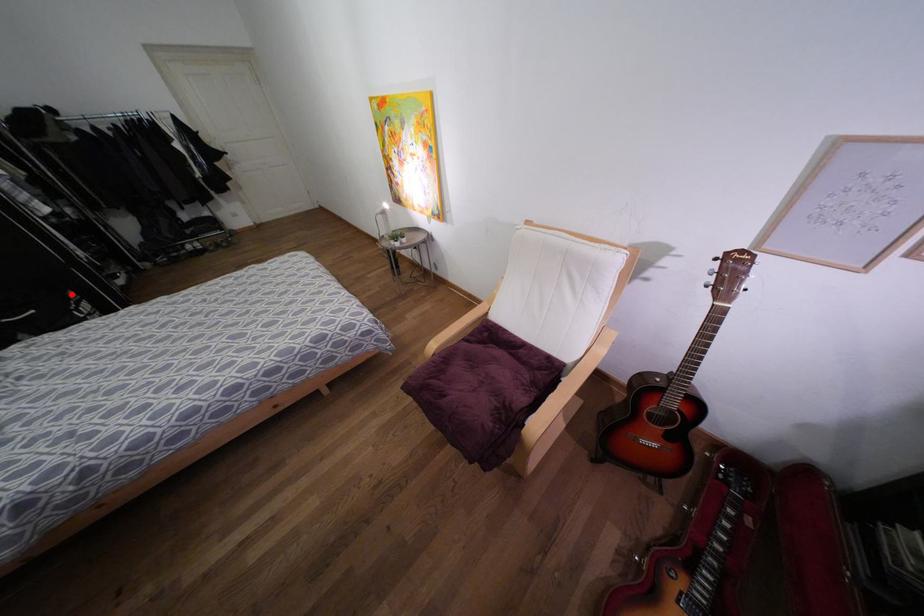
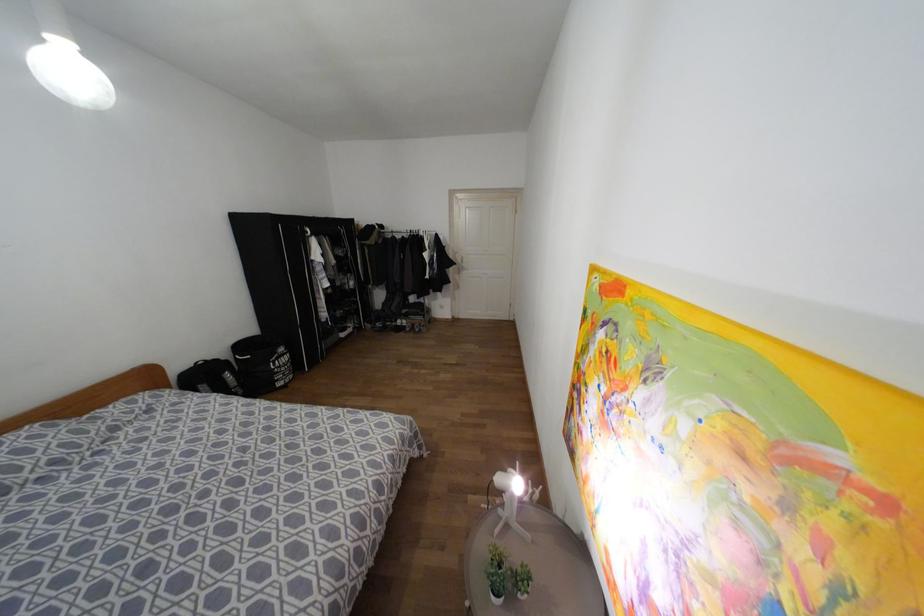
Question: I am providing you with two images of the same scene from different viewpoints. A red point is shown in image1. For the corresponding object point in image2, is it positioned nearer or farther from the camera?

Choices:
 (A) Nearer
 (B) Farther

Answer: (A)